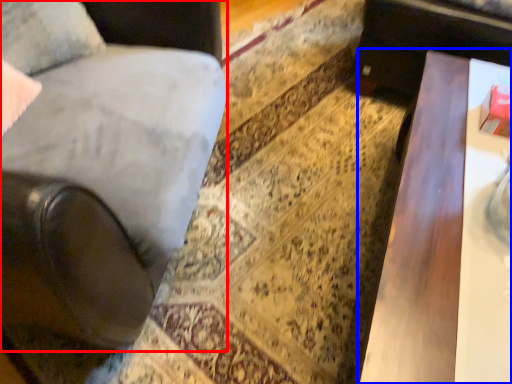
Question: Which point is further to the camera, chair (highlighted by a red box) or table (highlighted by a blue box)?

Choices:
 (A) chair
 (B) table

Answer: (B)